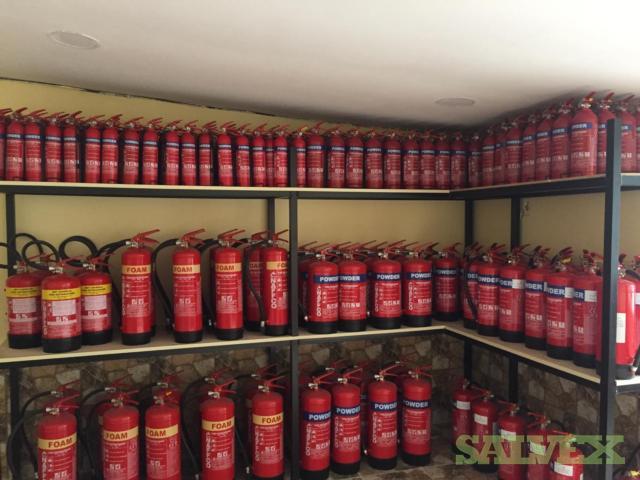
Where is `brown wall`? The image size is (640, 480). brown wall is located at coordinates (386, 226), (127, 214).